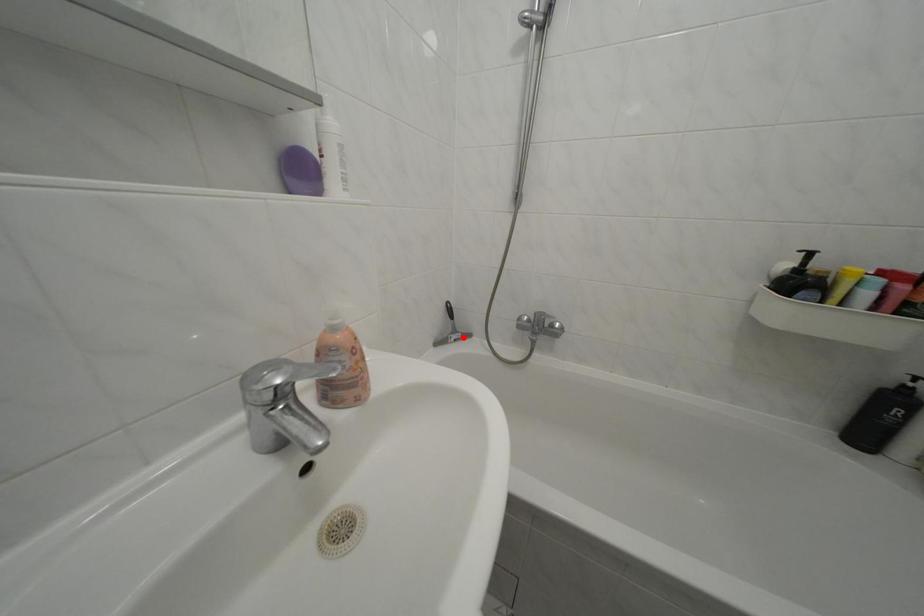
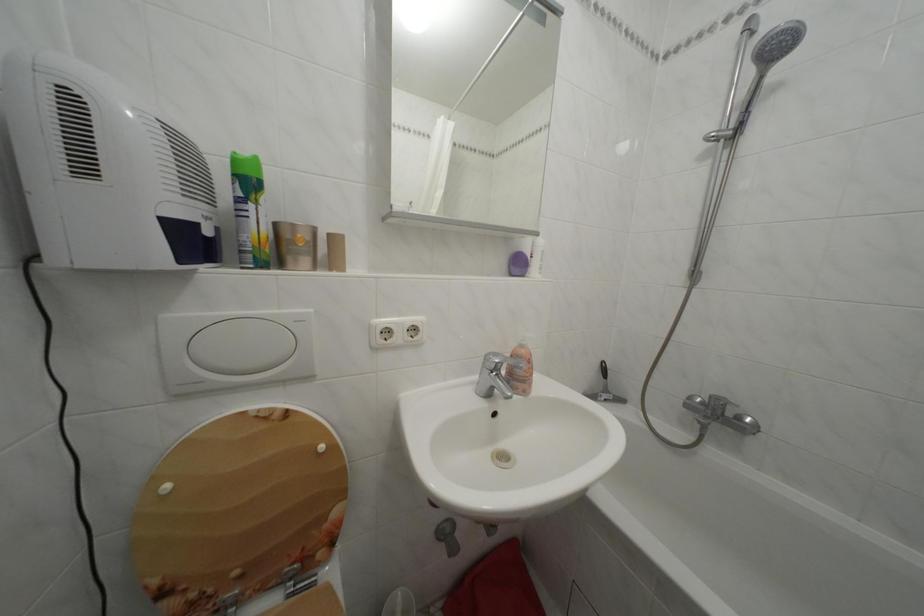
Question: I am providing you with two images of the same scene from different viewpoints. In image1, a red point is highlighted. Considering the same 3D point in image2, which of the following is correct?

Choices:
 (A) It is closer
 (B) It is farther

Answer: (B)